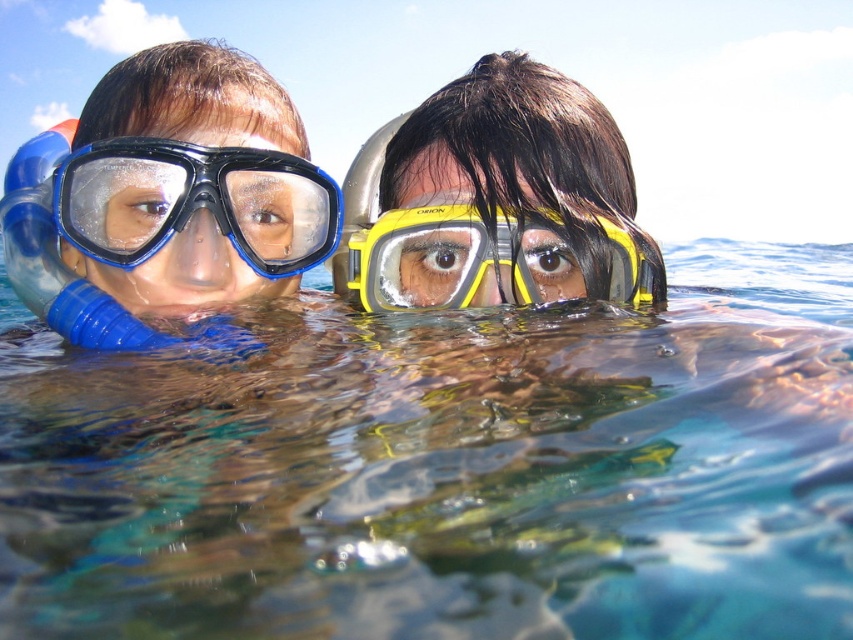
You are a photographer standing at the edge of the water, aiming to capture the point at coordinates point (354, 588). If your camera has a maximum focus range of 50 centimeters, will you be able to focus on the point?

The point (354, 588) is 46.74 centimeters away from the viewer, which is within the camera maximum focus range of 50 centimeters. Therefore, the camera can focus on the point.